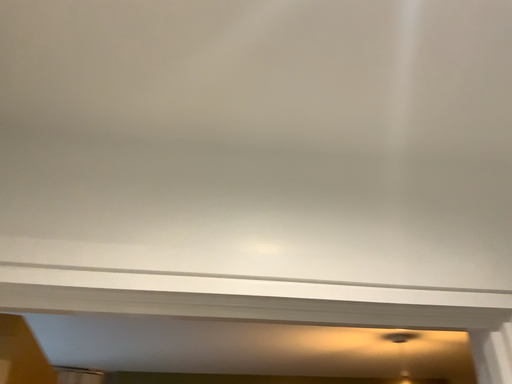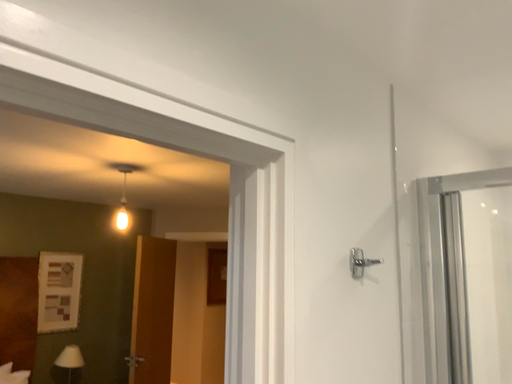
Question: How did the camera likely rotate when shooting the video?

Choices:
 (A) rotated upward
 (B) rotated downward

Answer: (B)